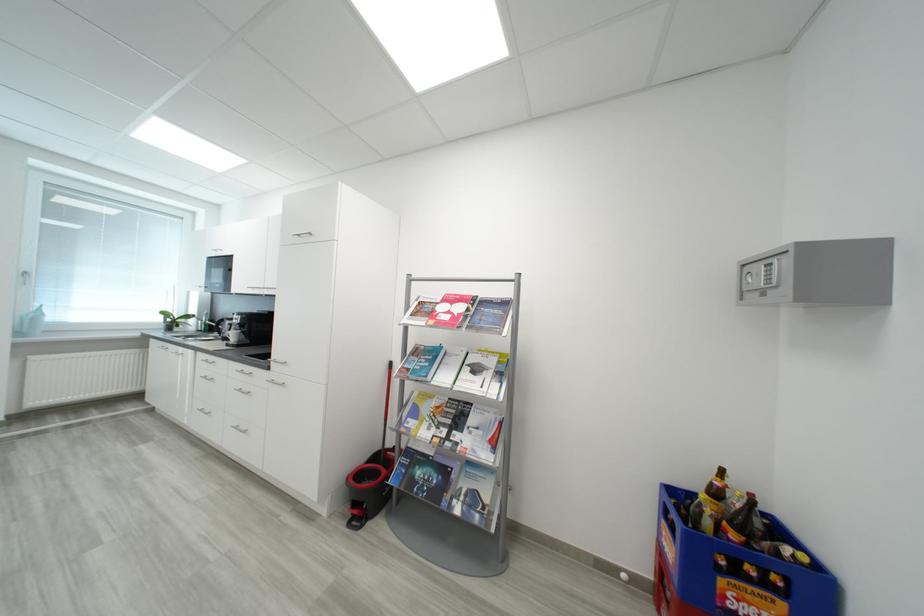
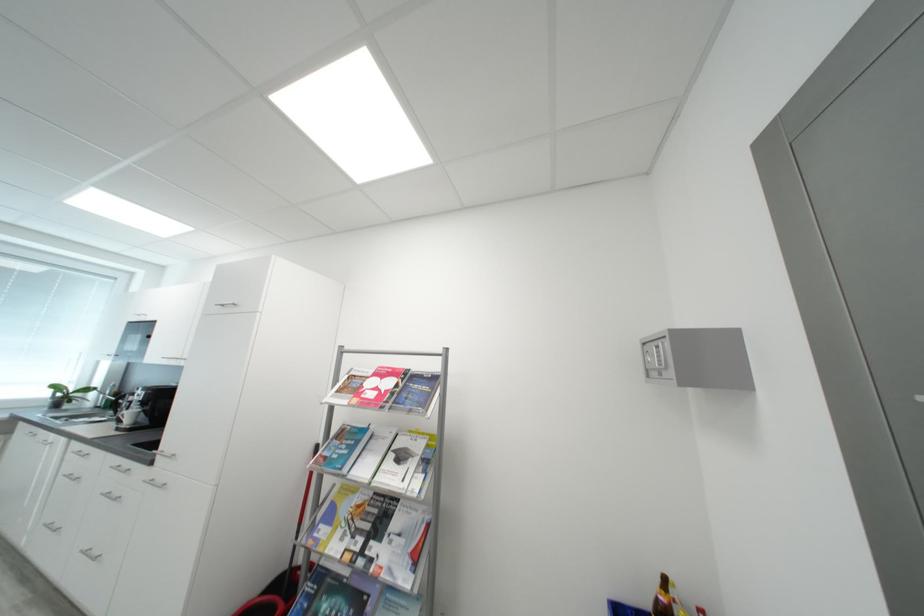
Find the pixel in the second image that matches point (205, 321) in the first image.

(108, 394)